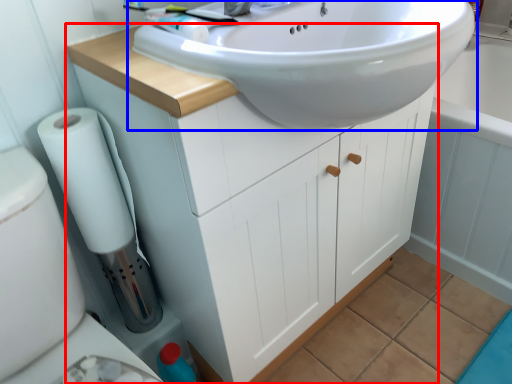
Question: Among these objects, which one is nearest to the camera, bathroom cabinet (highlighted by a red box) or sink (highlighted by a blue box)?

Choices:
 (A) bathroom cabinet
 (B) sink

Answer: (B)